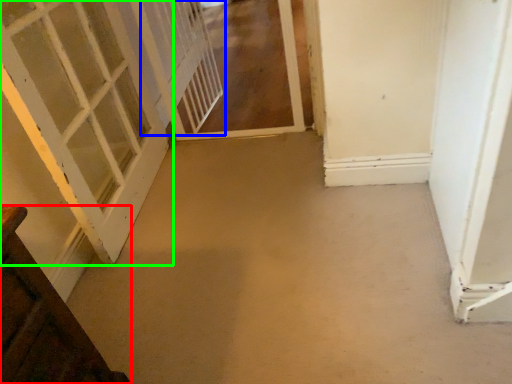
Question: Considering the real-world distances, which object is farthest from door (highlighted by a red box)? screen door (highlighted by a blue box) or door (highlighted by a green box)?

Choices:
 (A) screen door
 (B) door

Answer: (A)